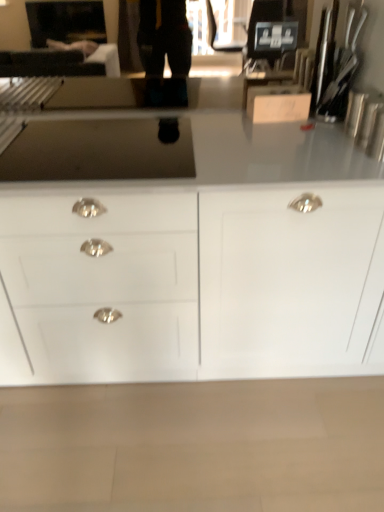
Describe the element at coordinates (189, 283) in the screenshot. I see `white glossy cabinet at center` at that location.

Find the location of `white glossy cabinet at center`. white glossy cabinet at center is located at coordinates [x=189, y=283].

What is the approximate height of white glossy cabinet at center?

white glossy cabinet at center is 35.83 inches in height.

This screenshot has width=384, height=512. I want to click on white glossy cabinet at center, so click(x=189, y=283).